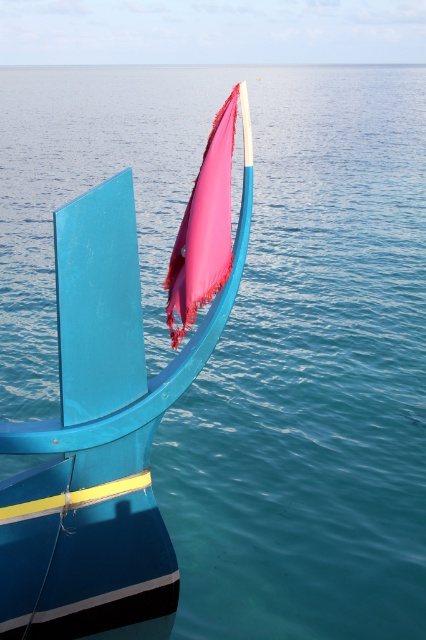
Based on the photo, is matte blue boat at center above pink fabric flag at center?

Incorrect, matte blue boat at center is not positioned above pink fabric flag at center.

Describe the element at coordinates (100, 435) in the screenshot. This screenshot has height=640, width=426. I see `matte blue boat at center` at that location.

Which is behind, point (60, 532) or point (215, 122)?

Positioned behind is point (60, 532).

Image resolution: width=426 pixels, height=640 pixels. I want to click on matte blue boat at center, so click(100, 435).